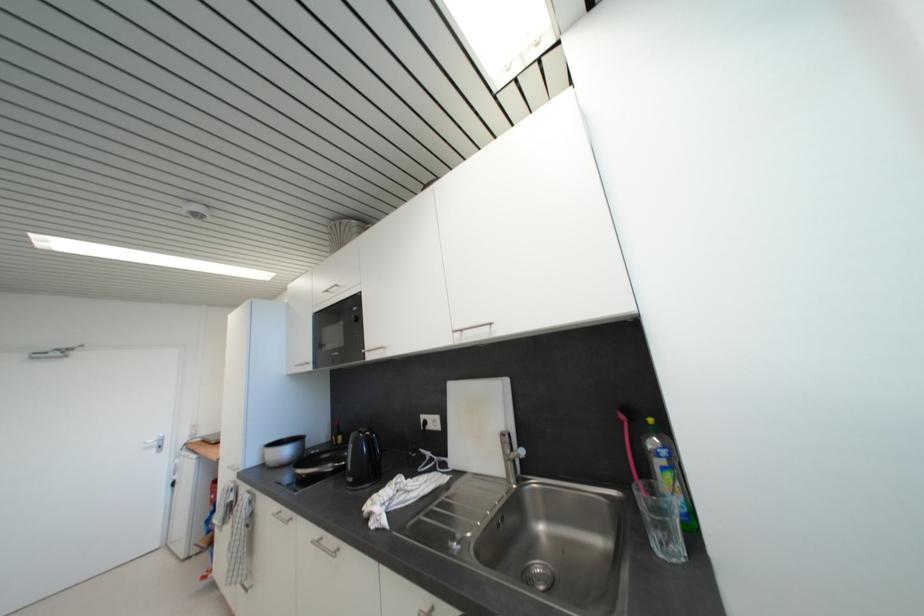
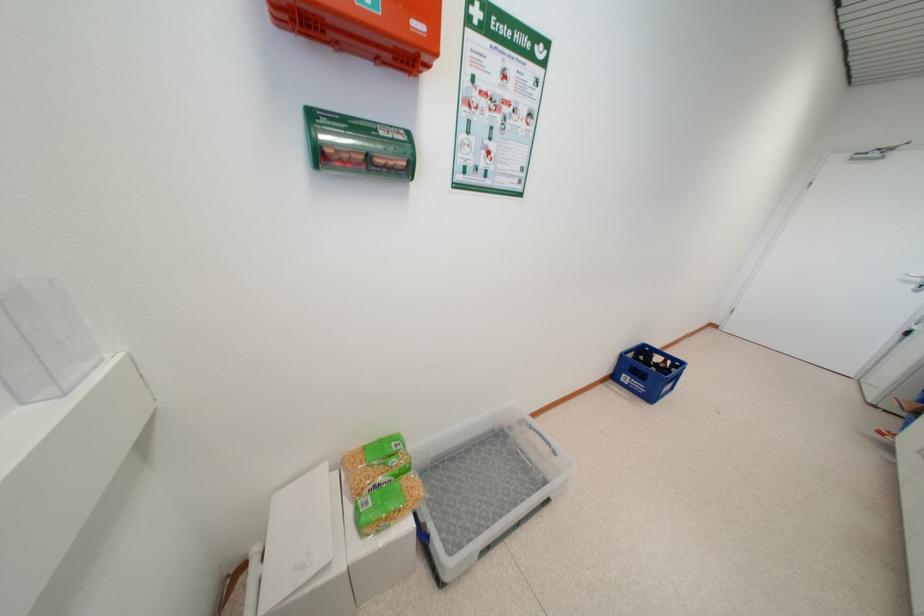
The first image is from the beginning of the video and the second image is from the end. How did the camera likely rotate when shooting the video?

The rotation direction of the camera is left-down.